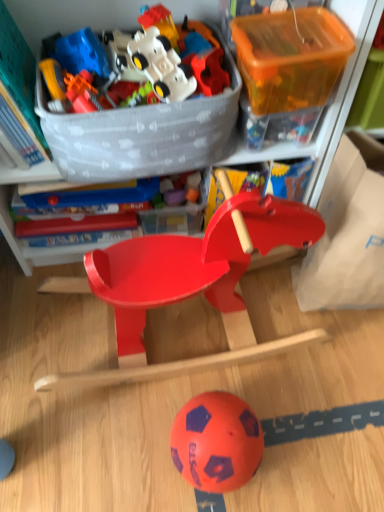
The height and width of the screenshot is (512, 384). I want to click on vacant area that is in front of matte plastic storage box at right, arranged as the first storage box when viewed from the right, so click(335, 382).